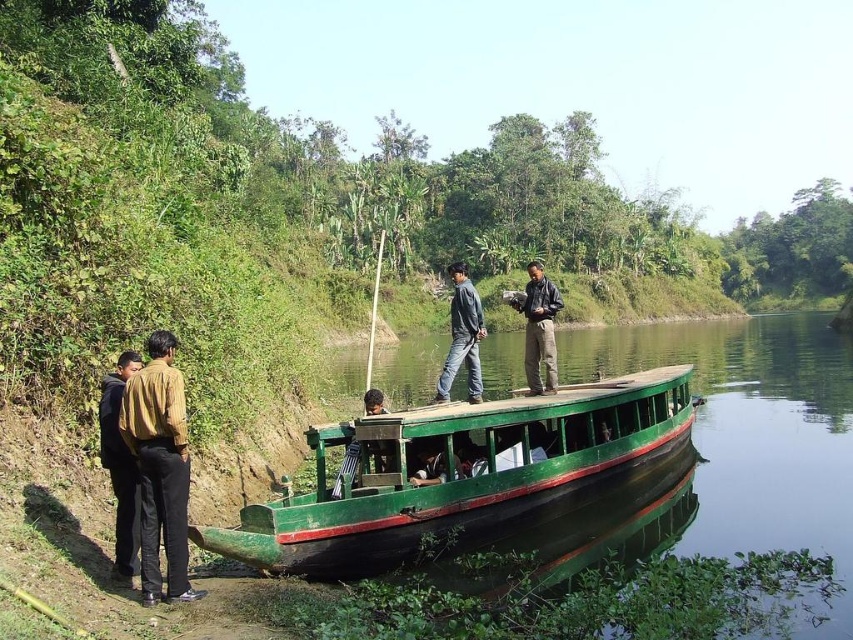
Which of these two, brown cotton shirt at left or dark blue jeans at center, stands taller?

dark blue jeans at center is taller.

Based on the photo, is the position of brown cotton shirt at left more distant than that of dark blue jeans at center?

No, it is not.

Who is more forward, (172, 529) or (474, 372)?

Point (172, 529)

Identify the location of brown cotton shirt at left. (160, 467).

Which of these two, brown cotton shirt at left or dark brown leather jacket at lower left, stands shorter?

Standing shorter between the two is dark brown leather jacket at lower left.

Between brown cotton shirt at left and dark brown leather jacket at lower left, which one appears on the left side from the viewer's perspective?

Positioned to the left is dark brown leather jacket at lower left.

In order to click on brown cotton shirt at left in this screenshot , I will do `click(160, 467)`.

Measure the distance from green matte boat at center to dark brown leather jacket at lower left.

A distance of 5.85 meters exists between green matte boat at center and dark brown leather jacket at lower left.

Is point (352, 564) positioned in front of point (107, 380)?

No, it is not.

Where is `green matte boat at center`? The width and height of the screenshot is (853, 640). green matte boat at center is located at coordinates [x=459, y=474].